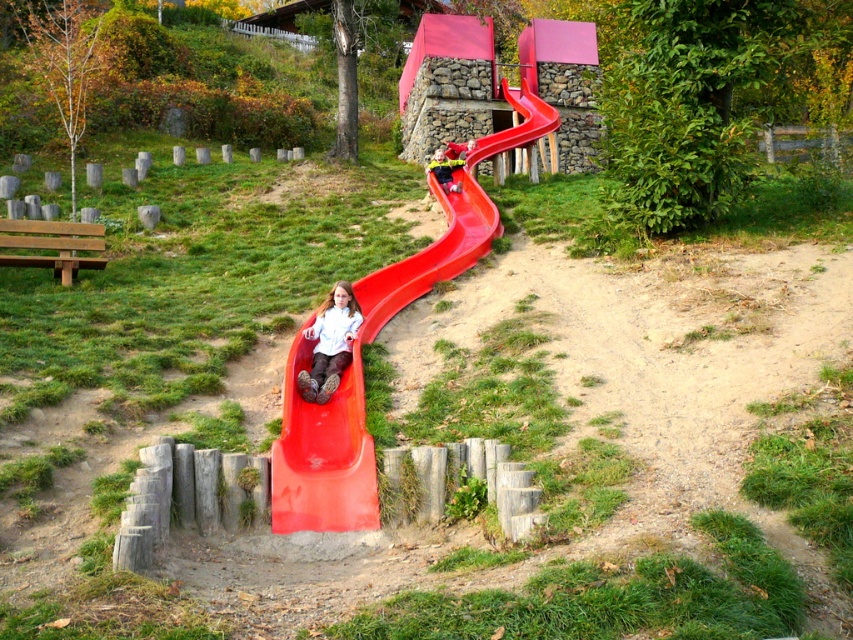
You are standing at the playground and want to reach the smooth plastic slide at lower left. If you can walk 10 feet per minute, how long will it take you to reach the slide?

The smooth plastic slide at lower left is 42.29 feet away. At a walking speed of 10 feet per minute, it would take approximately 4.23 minutes to reach the slide.

You are standing at the entrance of the playground and want to locate the matte white shirt at center. According to the coordinates provided, where would you look to find it?

The matte white shirt at center is located at the coordinates point (x=329, y=342).